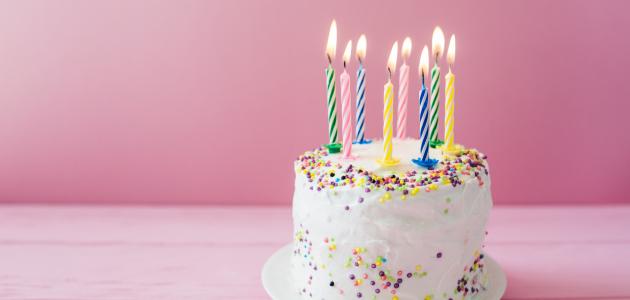
Find the location of a particular element. birthday candle plastic holder is located at coordinates (391, 159), (344, 158), (335, 144), (358, 138), (433, 140), (454, 149), (433, 161), (399, 135).